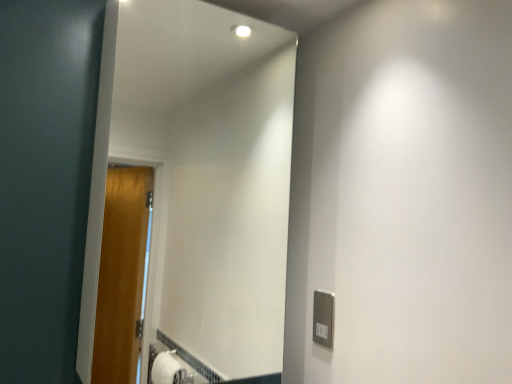
Question: Could you tell me if white glossy mirror at center is facing white plastic outlet at lower right?

Choices:
 (A) no
 (B) yes

Answer: (A)

Question: Is the position of white glossy mirror at center less distant than that of white plastic outlet at lower right?

Choices:
 (A) yes
 (B) no

Answer: (A)

Question: Is white glossy mirror at center to the right of white plastic outlet at lower right from the viewer's perspective?

Choices:
 (A) no
 (B) yes

Answer: (A)

Question: From a real-world perspective, is white glossy mirror at center physically below white plastic outlet at lower right?

Choices:
 (A) no
 (B) yes

Answer: (A)

Question: Is white glossy mirror at center at the left side of white plastic outlet at lower right?

Choices:
 (A) no
 (B) yes

Answer: (B)

Question: From the image's perspective, is white glossy mirror at center below white plastic outlet at lower right?

Choices:
 (A) no
 (B) yes

Answer: (A)

Question: Is white plastic outlet at lower right to the left of white glossy mirror at center from the viewer's perspective?

Choices:
 (A) no
 (B) yes

Answer: (A)

Question: Is white plastic outlet at lower right not within white glossy mirror at center?

Choices:
 (A) yes
 (B) no

Answer: (A)

Question: Can white glossy mirror at center be found inside white plastic outlet at lower right?

Choices:
 (A) no
 (B) yes

Answer: (A)

Question: Is white plastic outlet at lower right closer to the viewer compared to white glossy mirror at center?

Choices:
 (A) no
 (B) yes

Answer: (A)

Question: From a real-world perspective, does white plastic outlet at lower right sit lower than white glossy mirror at center?

Choices:
 (A) no
 (B) yes

Answer: (B)

Question: Considering the relative sizes of white plastic outlet at lower right and white glossy mirror at center in the image provided, is white plastic outlet at lower right taller than white glossy mirror at center?

Choices:
 (A) no
 (B) yes

Answer: (A)

Question: From the image's perspective, is white plastic outlet at lower right positioned above or below white glossy mirror at center?

Choices:
 (A) below
 (B) above

Answer: (A)